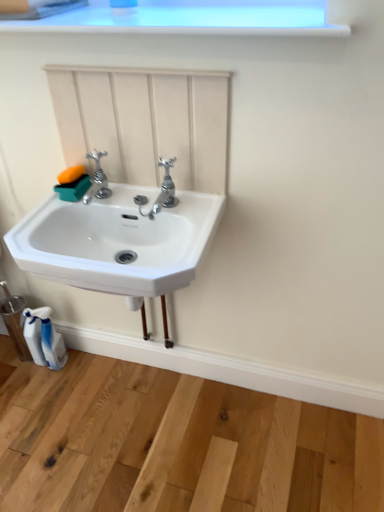
Question: Can white ceramic sink at center be found inside polished chrome faucet at center, which appears as the 2th tap when viewed from the left?

Choices:
 (A) no
 (B) yes

Answer: (A)

Question: Can you confirm if polished chrome faucet at center, which appears as the 2th tap when viewed from the left, is wider than white ceramic sink at center?

Choices:
 (A) yes
 (B) no

Answer: (B)

Question: Would you say polished chrome faucet at center, the first tap positioned from the right, is outside white ceramic sink at center?

Choices:
 (A) no
 (B) yes

Answer: (B)

Question: From the image's perspective, is polished chrome faucet at center, which appears as the 2th tap when viewed from the left, above white ceramic sink at center?

Choices:
 (A) no
 (B) yes

Answer: (B)

Question: Is polished chrome faucet at center, which appears as the 2th tap when viewed from the left, at the left side of white ceramic sink at center?

Choices:
 (A) yes
 (B) no

Answer: (B)

Question: Is white ceramic sink at center bigger or smaller than polished chrome faucet at center, the first tap positioned from the right?

Choices:
 (A) small
 (B) big

Answer: (B)

Question: From a real-world perspective, is white ceramic sink at center positioned above or below polished chrome faucet at center, which appears as the 2th tap when viewed from the left?

Choices:
 (A) below
 (B) above

Answer: (A)

Question: Looking at their shapes, would you say white ceramic sink at center is wider or thinner than polished chrome faucet at center, the first tap positioned from the right?

Choices:
 (A) wide
 (B) thin

Answer: (A)

Question: Is white ceramic sink at center inside or outside of polished chrome faucet at center, the first tap positioned from the right?

Choices:
 (A) outside
 (B) inside

Answer: (A)

Question: From a real-world perspective, is white plastic window frame at upper center physically located above or below polished chrome faucet at center, which appears as the 2th tap when viewed from the left?

Choices:
 (A) above
 (B) below

Answer: (A)

Question: Do you think white plastic window frame at upper center is within polished chrome faucet at center, the first tap positioned from the right, or outside of it?

Choices:
 (A) inside
 (B) outside

Answer: (B)

Question: Looking at their shapes, would you say white plastic window frame at upper center is wider or thinner than polished chrome faucet at center, the first tap positioned from the right?

Choices:
 (A) thin
 (B) wide

Answer: (B)

Question: From the image's perspective, is white plastic window frame at upper center above or below polished chrome faucet at center, the first tap positioned from the right?

Choices:
 (A) below
 (B) above

Answer: (B)

Question: Is polished chrome tap at center, the 1th tap viewed from the left, inside or outside of polished chrome faucet at center, which appears as the 2th tap when viewed from the left?

Choices:
 (A) inside
 (B) outside

Answer: (B)

Question: Considering the positions of polished chrome tap at center, the 1th tap viewed from the left, and polished chrome faucet at center, which appears as the 2th tap when viewed from the left, in the image, is polished chrome tap at center, the 1th tap viewed from the left, taller or shorter than polished chrome faucet at center, which appears as the 2th tap when viewed from the left,?

Choices:
 (A) short
 (B) tall

Answer: (A)